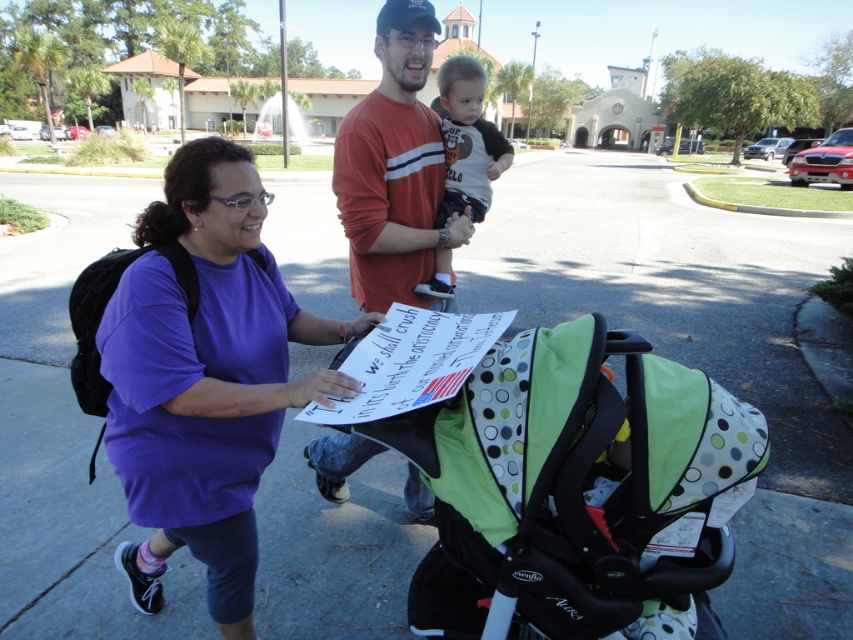
Question: Can you confirm if green polka dot fabric baby carriage at center is positioned to the left of matte brown shirt at center?

Choices:
 (A) no
 (B) yes

Answer: (B)

Question: Is green polka dot fabric baby carriage at center below purple fabric shirt at center?

Choices:
 (A) yes
 (B) no

Answer: (A)

Question: Can you confirm if purple fabric shirt at center is positioned above matte brown shirt at center?

Choices:
 (A) no
 (B) yes

Answer: (A)

Question: Which of the following is the closest to the observer?

Choices:
 (A) green polka dot fabric baby carriage at center
 (B) orange cotton shirt at center
 (C) purple fabric shirt at center
 (D) matte brown shirt at center

Answer: (A)

Question: Considering the real-world distances, which object is farthest from the orange cotton shirt at center?

Choices:
 (A) green polka dot fabric baby carriage at center
 (B) matte brown shirt at center

Answer: (A)

Question: Which is nearer to the orange cotton shirt at center?

Choices:
 (A) matte brown shirt at center
 (B) green polka dot fabric baby carriage at center
 (C) purple fabric shirt at center

Answer: (A)